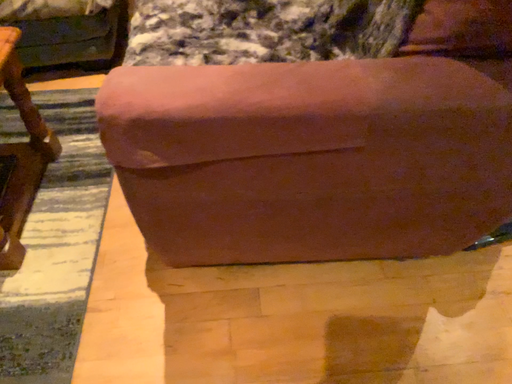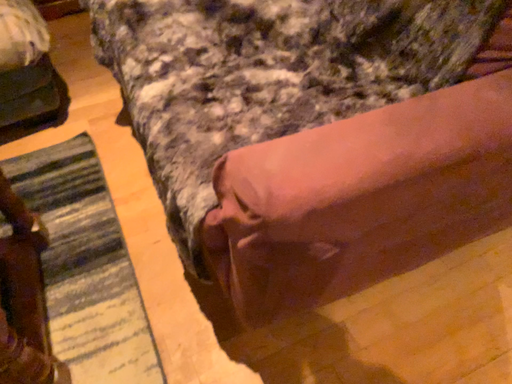
Question: How did the camera likely rotate when shooting the video?

Choices:
 (A) rotated left
 (B) rotated right

Answer: (B)